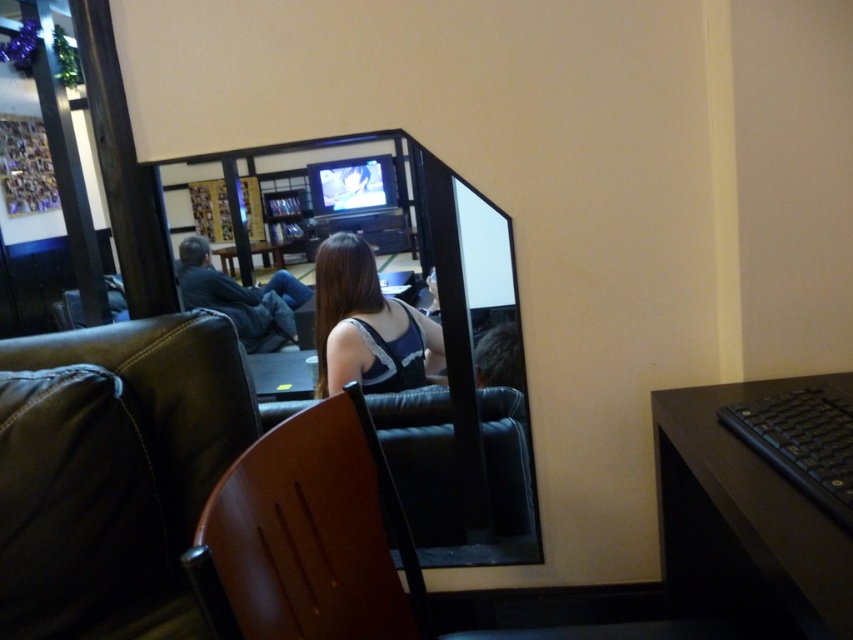
Between leather couch at lower left and matte black tv at upper center, which one is positioned lower?

leather couch at lower left is below.

Is leather couch at lower left below matte black tv at upper center?

Correct, leather couch at lower left is located below matte black tv at upper center.

The width and height of the screenshot is (853, 640). Identify the location of leather couch at lower left. (113, 472).

Between dark blue jeans at left and wooden table at center, which one appears on the left side from the viewer's perspective?

From the viewer's perspective, wooden table at center appears more on the left side.

Image resolution: width=853 pixels, height=640 pixels. What are the coordinates of `dark blue jeans at left` in the screenshot? It's located at (241, 298).

What are the coordinates of `dark blue jeans at left` in the screenshot? It's located at (241, 298).

Is the position of brown leather chair at center less distant than that of satin black top at center?

That is True.

Does brown leather chair at center appear under satin black top at center?

Yes.

Identify the location of brown leather chair at center. (308, 536).